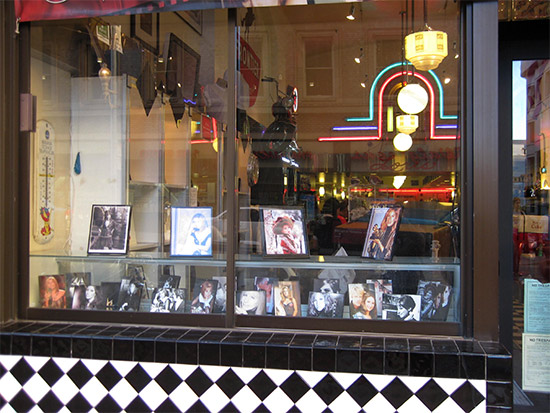
Find the location of a particular element. black tile is located at coordinates [x=268, y=388].